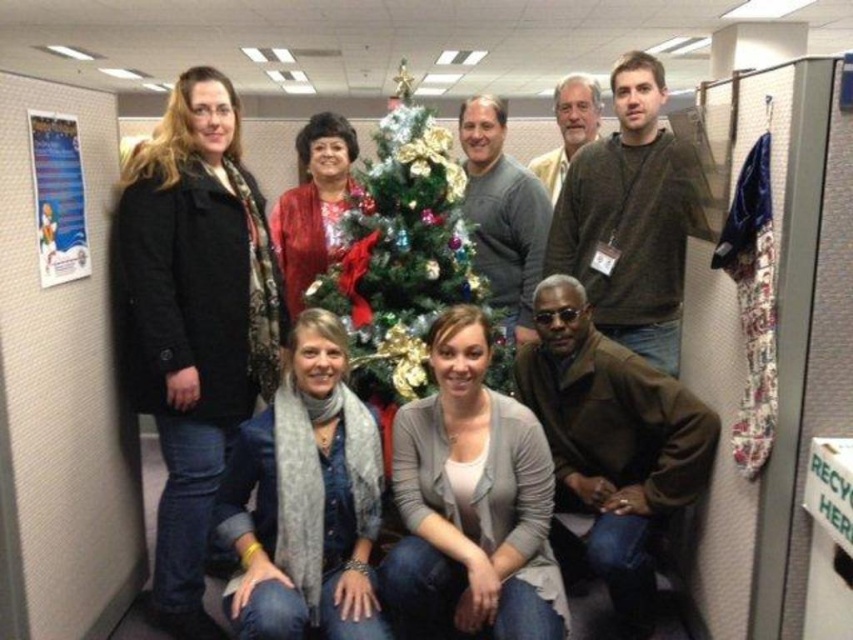
Question: Which is nearer to the green shiny christmas tree at center?

Choices:
 (A) gray cardigan at lower center
 (B) brown leather jacket at lower right
 (C) brown cotton shirt at upper right

Answer: (B)

Question: Is gray cardigan at lower center positioned at the back of brown cotton shirt at upper right?

Choices:
 (A) no
 (B) yes

Answer: (A)

Question: Is black matte coat at left positioned in front of gray cardigan at lower center?

Choices:
 (A) no
 (B) yes

Answer: (A)

Question: Among these objects, which one is farthest from the camera?

Choices:
 (A) gray scarf at lower center
 (B) black matte coat at left
 (C) brown cotton shirt at upper right

Answer: (C)

Question: Among these objects, which one is farthest from the camera?

Choices:
 (A) green shiny christmas tree at center
 (B) gray cardigan at lower center
 (C) brown cotton shirt at upper right
 (D) black matte coat at left

Answer: (A)

Question: Observing the image, what is the correct spatial positioning of gray cardigan at lower center in reference to brown leather jacket at lower right?

Choices:
 (A) below
 (B) above

Answer: (A)